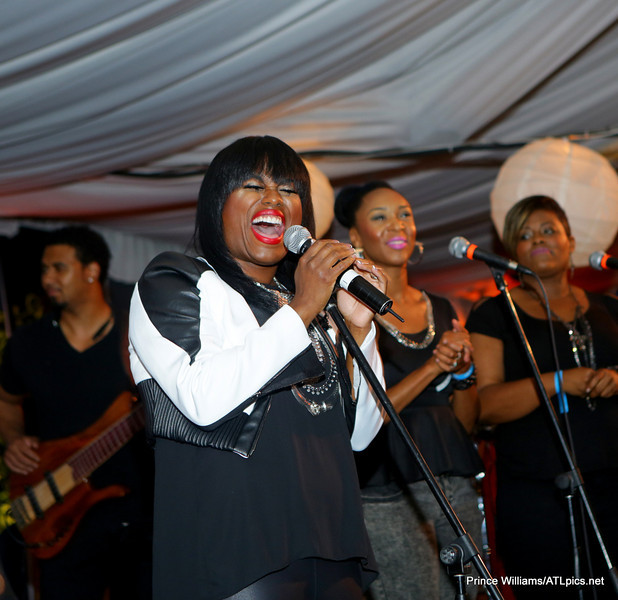
Image resolution: width=618 pixels, height=600 pixels. Find the location of `mic stands`. mic stands is located at coordinates (434, 500), (568, 473).